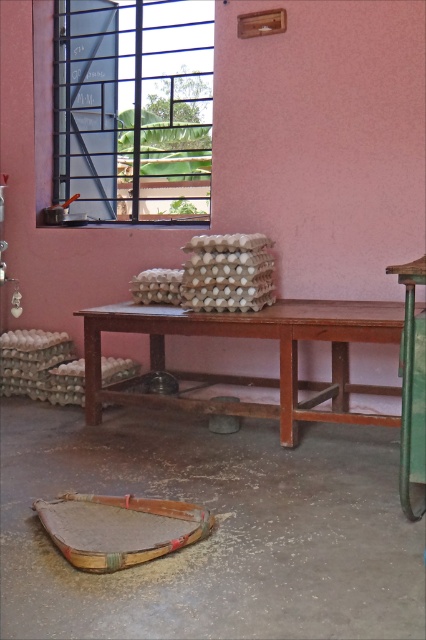
Which of these two, metallic grid window at upper left or green plastic stool at lower right, stands taller?

metallic grid window at upper left is taller.

Can you confirm if metallic grid window at upper left is positioned below green plastic stool at lower right?

Actually, metallic grid window at upper left is above green plastic stool at lower right.

Is point (71, 131) more distant than point (425, 253)?

Yes, it is.

Locate an element on the screen. metallic grid window at upper left is located at coordinates (132, 109).

Consider the image. Does wooden tray at lower center have a lesser width compared to green plastic stool at lower right?

In fact, wooden tray at lower center might be wider than green plastic stool at lower right.

Is wooden tray at lower center shorter than green plastic stool at lower right?

Indeed, wooden tray at lower center has a lesser height compared to green plastic stool at lower right.

Does point (57, 524) come behind point (411, 412)?

Yes.

Locate an element on the screen. The image size is (426, 640). wooden tray at lower center is located at coordinates (120, 529).

Who is more forward, (89, 136) or (348, 308)?

Positioned in front is point (348, 308).

Is metallic grid window at upper left positioned in front of brown wooden picnic table at center?

No, metallic grid window at upper left is behind brown wooden picnic table at center.

Which is in front, point (104, 160) or point (279, 368)?

Positioned in front is point (279, 368).

This screenshot has height=640, width=426. I want to click on metallic grid window at upper left, so click(x=132, y=109).